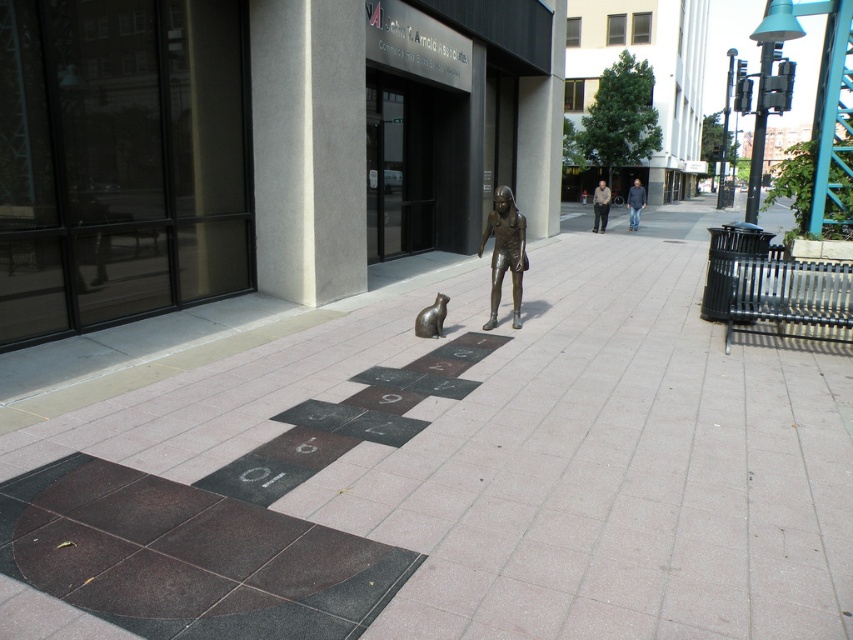
In the scene shown: You are a delivery drone that needs to land on the smooth concrete pavement at center. The bronze cat at center is in your landing path. Can you safely land there without hitting the bronze cat?

The smooth concrete pavement at center has a greater height compared to bronze cat at center, so yes, the drone can safely land there as the pavement is elevated above the bronze cat.

You are standing on the smooth concrete pavement at center and want to reach the bronze cat at center. Can you step down to touch it?

The smooth concrete pavement at center is above bronze cat at center, so yes, you can step down from the smooth concrete pavement at center to touch the bronze cat at center.

You are standing on the hopscotch grid and see the bronze statue at center and the bronze cat at center. Which one is positioned to the right side?

The bronze statue at center is positioned to the right of the bronze cat at center.